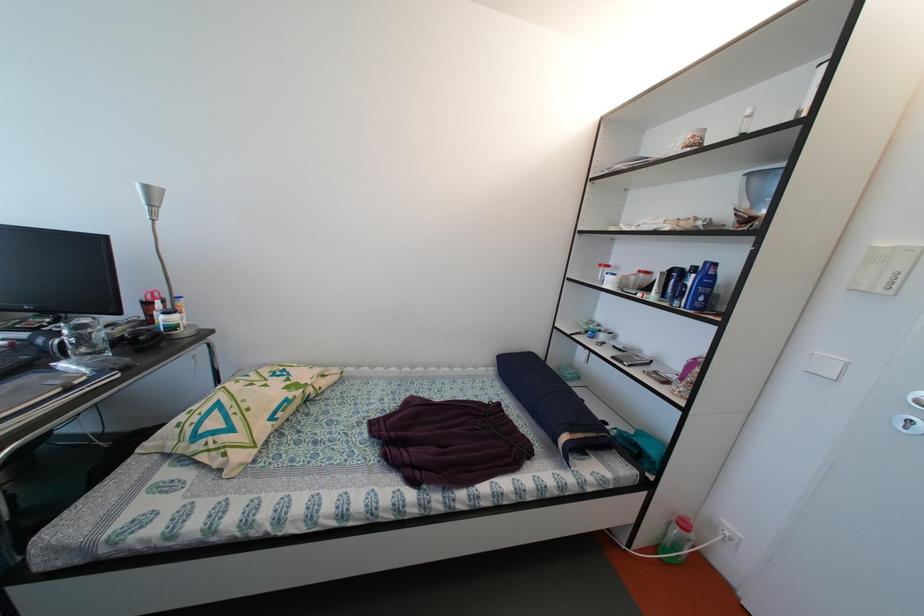
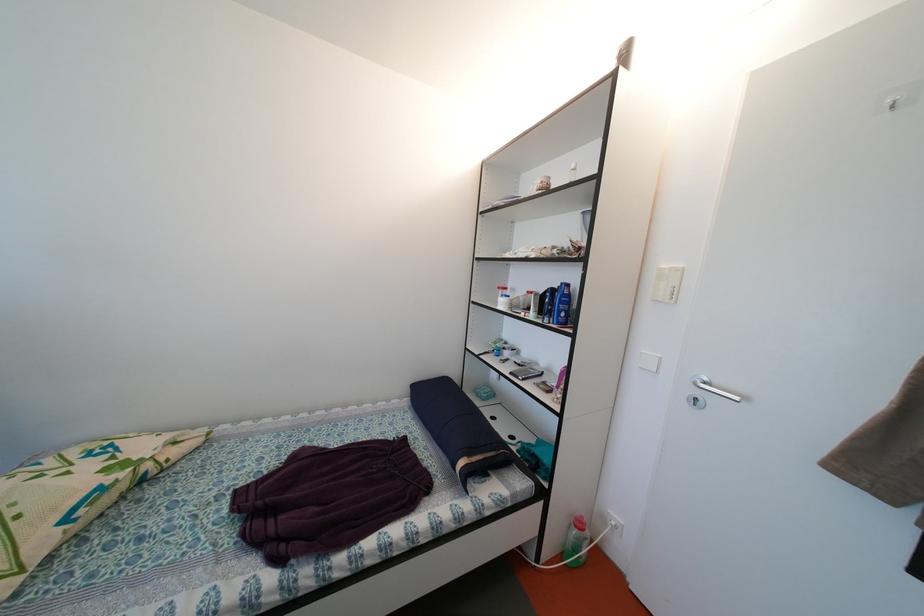
The point at (713, 268) is marked in the first image. Where is the corresponding point in the second image?

(569, 289)